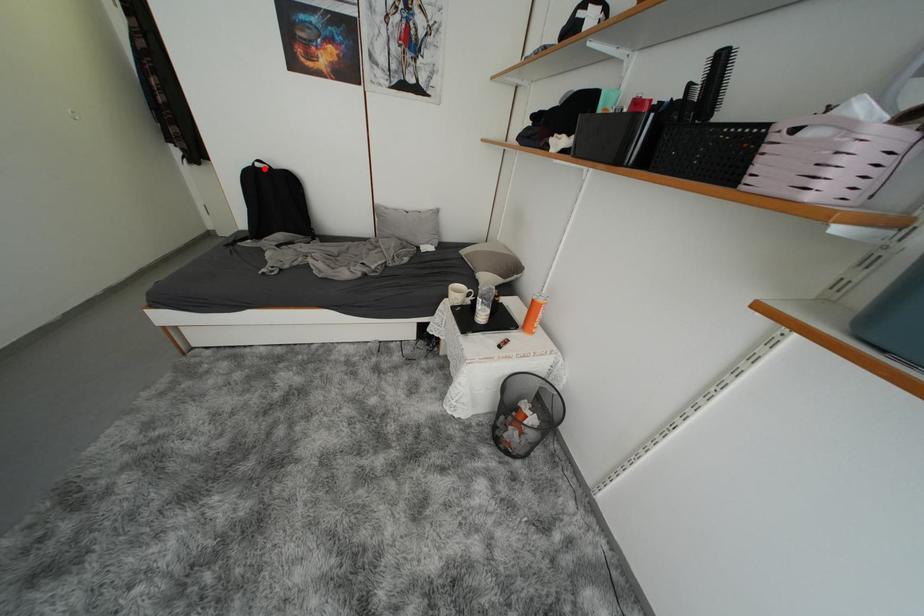
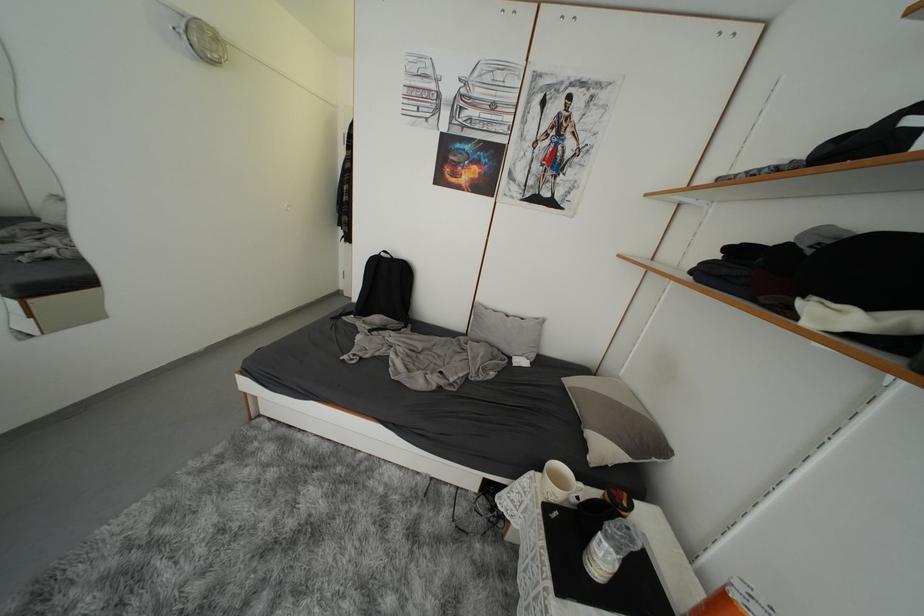
Locate, in the second image, the point that corresponds to the highlighted location in the first image.

(390, 257)